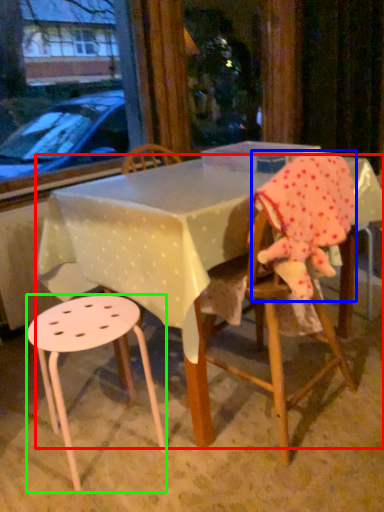
Question: Estimate the real-world distances between objects in this image. Which object is farther from table (highlighted by a red box), toddler (highlighted by a blue box) or stool (highlighted by a green box)?

Choices:
 (A) toddler
 (B) stool

Answer: (A)